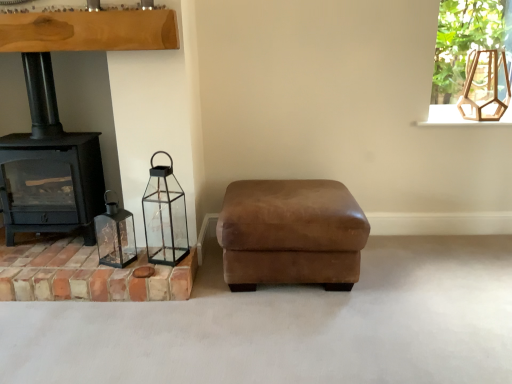
Question: Does matte glass lantern at left, the 1th candle holder when ordered from left to right, appear on the left side of brown suede ottoman at center?

Choices:
 (A) no
 (B) yes

Answer: (B)

Question: From a real-world perspective, is matte glass lantern at left, arranged as the second candle holder when viewed from the right, on top of brown suede ottoman at center?

Choices:
 (A) yes
 (B) no

Answer: (A)

Question: Does matte glass lantern at left, the 1th candle holder when ordered from left to right, have a lesser width compared to brown suede ottoman at center?

Choices:
 (A) yes
 (B) no

Answer: (A)

Question: From a real-world perspective, is matte glass lantern at left, the 1th candle holder when ordered from left to right, located beneath brown suede ottoman at center?

Choices:
 (A) yes
 (B) no

Answer: (B)

Question: Is matte glass lantern at left, arranged as the second candle holder when viewed from the right, positioned behind brown suede ottoman at center?

Choices:
 (A) yes
 (B) no

Answer: (A)

Question: Considering the relative sizes of matte glass lantern at left, the 1th candle holder when ordered from left to right, and brown suede ottoman at center in the image provided, is matte glass lantern at left, the 1th candle holder when ordered from left to right, taller than brown suede ottoman at center?

Choices:
 (A) no
 (B) yes

Answer: (A)

Question: From the image's perspective, would you say clear glass frame at upper right is shown under wooden hexagonal lantern at upper right?

Choices:
 (A) yes
 (B) no

Answer: (B)

Question: From a real-world perspective, is clear glass frame at upper right positioned over wooden hexagonal lantern at upper right based on gravity?

Choices:
 (A) yes
 (B) no

Answer: (A)

Question: Does clear glass frame at upper right have a larger size compared to wooden hexagonal lantern at upper right?

Choices:
 (A) no
 (B) yes

Answer: (B)

Question: Does clear glass frame at upper right appear on the right side of wooden hexagonal lantern at upper right?

Choices:
 (A) no
 (B) yes

Answer: (B)

Question: From a real-world perspective, is clear glass frame at upper right below wooden hexagonal lantern at upper right?

Choices:
 (A) yes
 (B) no

Answer: (B)

Question: Is clear glass frame at upper right placed right next to wooden hexagonal lantern at upper right?

Choices:
 (A) no
 (B) yes

Answer: (A)

Question: From a real-world perspective, is terracotta brick at lower left over wooden hexagonal lantern at upper right?

Choices:
 (A) yes
 (B) no

Answer: (B)